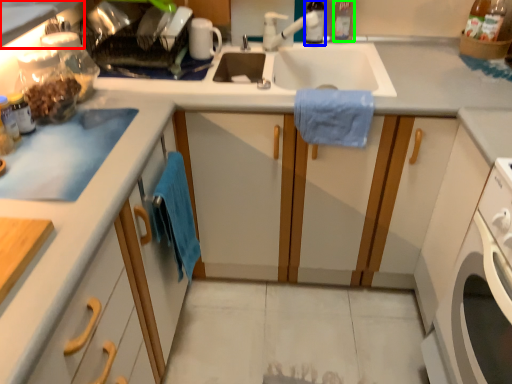
Question: Estimate the real-world distances between objects in this image. Which object is farther from countertop (highlighted by a red box), bottle (highlighted by a blue box) or bottle (highlighted by a green box)?

Choices:
 (A) bottle
 (B) bottle

Answer: (B)